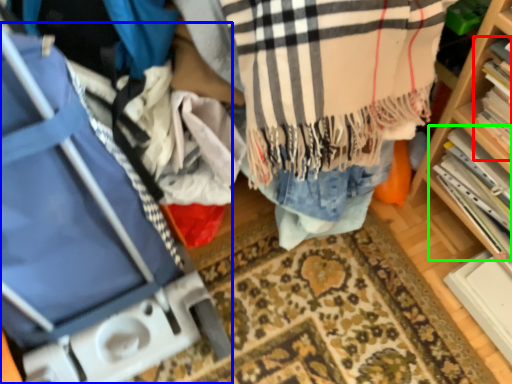
Question: Which is farther away from book (highlighted by a red box)? luggage (highlighted by a blue box) or book (highlighted by a green box)?

Choices:
 (A) luggage
 (B) book

Answer: (A)